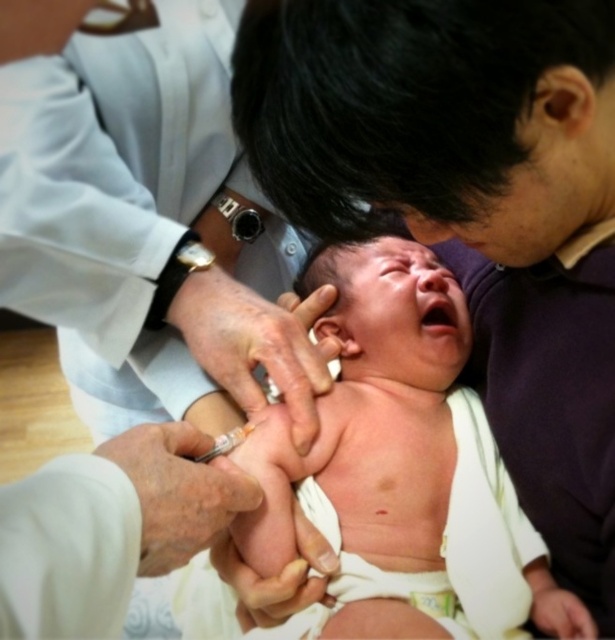
Does white smooth coat at upper left come behind smooth skin hand at center?

No.

Is white smooth coat at upper left taller than smooth skin hand at center?

Correct, white smooth coat at upper left is much taller as smooth skin hand at center.

Is point (62, 77) farther from viewer compared to point (330, 300)?

No.

Locate an element on the screen. white smooth coat at upper left is located at coordinates (148, 221).

Consider the image. Between pink smooth skin at center and smooth skin hand at center, which one has more height?

With more height is pink smooth skin at center.

Between pink smooth skin at center and smooth skin hand at center, which one is positioned higher?

smooth skin hand at center is above.

This screenshot has width=615, height=640. Identify the location of pink smooth skin at center. (371, 413).

This screenshot has height=640, width=615. What are the coordinates of `pink smooth skin at center` in the screenshot? It's located at (x=371, y=413).

Is white smooth coat at upper left wider than white smooth syringe at lower left?

Yes.

Can you confirm if white smooth coat at upper left is thinner than white smooth syringe at lower left?

Incorrect, white smooth coat at upper left's width is not less than white smooth syringe at lower left's.

Identify the location of white smooth coat at upper left. The image size is (615, 640). coord(148,221).